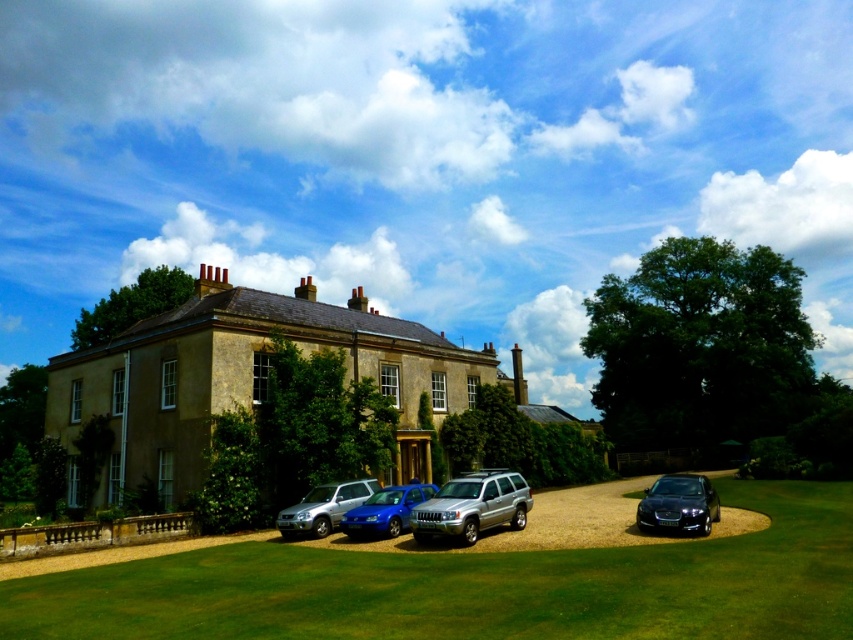
You are standing at the entrance of the driveway of the traditional house. You see the glossy black car at lower right and the satin silver suv at lower left. Which vehicle is closer to you?

The glossy black car at lower right is closer to you because it is positioned in front of the satin silver suv at lower left.

Consider the image. You are a delivery person who needs to park your van, which is 2 meters wide, in the driveway. There is space between the glossy black car at lower right and the satin silver suv at lower left. Can your van fit there?

The glossy black car at lower right is wider than the satin silver suv at lower left. Since the van is 2 meters wide, you need to check the space between them. If the space between the glossy black car at lower right and the satin silver suv at lower left is at least 2 meters, then the van can fit. However, the exact width of the space isn not provided, so it is uncertain.

You are standing on the driveway and see the green grass lawn at lower center and the satin silver suv at lower left. Which object is positioned to the right of the other?

The green grass lawn at lower center is to the right of the satin silver suv at lower left.